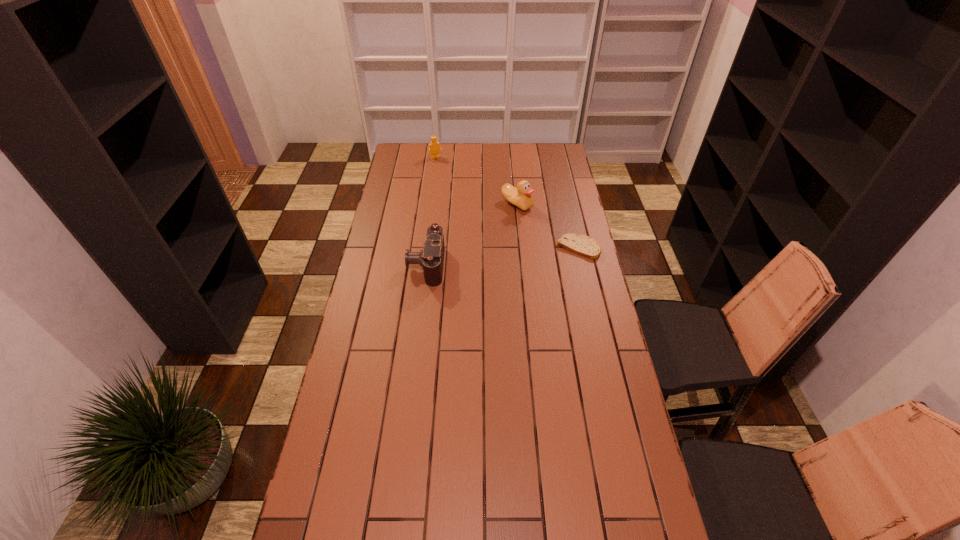
You are a GUI agent. You are given a task and a screenshot of the screen. Output one action in this format:
    pyautogui.click(x=<x>, y=<y>)
    Task: Click on the vacant spot on the desktop that is between the camera and the rightmost object and is positioned on the face of the Lego
    The image size is (960, 540).
    Given the screenshot: What is the action you would take?
    click(x=492, y=257)

Identify the location of free space on the desktop that is between the camera and the rightmost object and is positioned at the beak of the second farthest object. The image size is (960, 540). (519, 254).